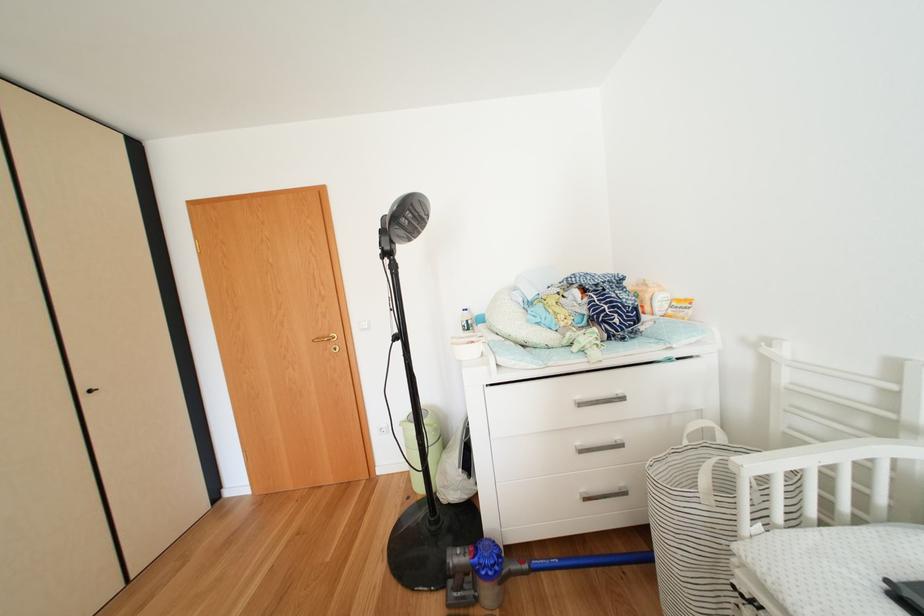
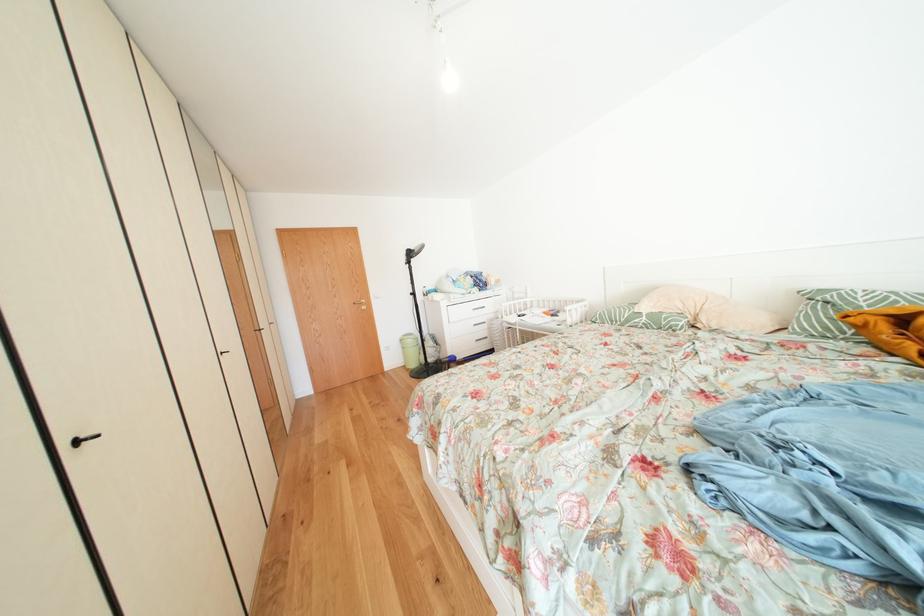
The images are taken continuously from a first-person perspective. In which direction are you moving?

The movement direction of the cameraman is left, backward.